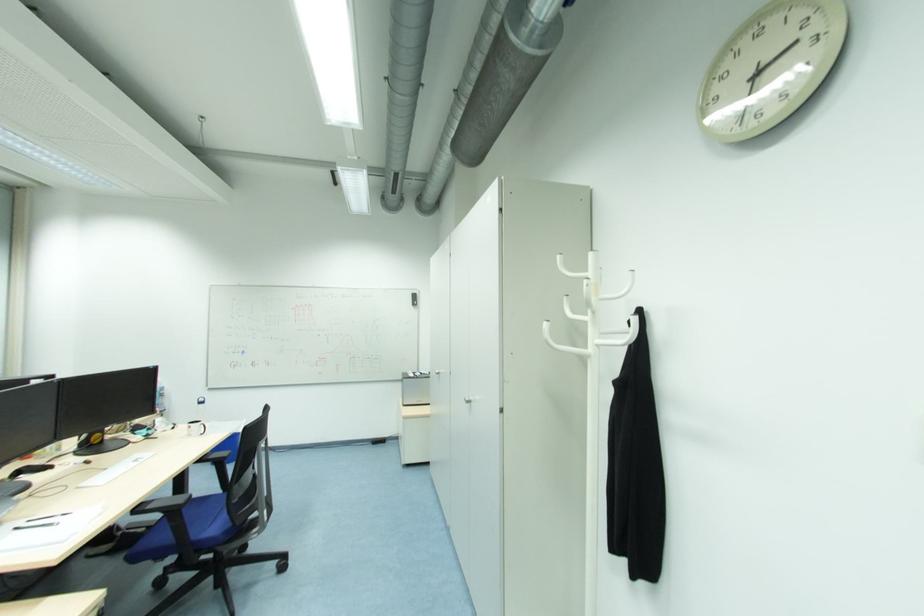
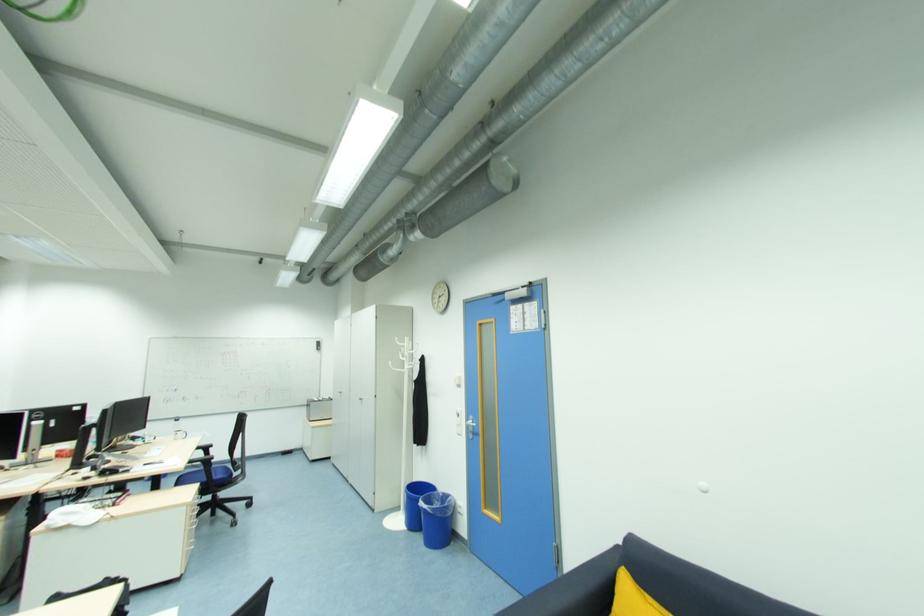
In the second image, find the point that corresponds to the point at 441,375 in the first image.

(344, 394)